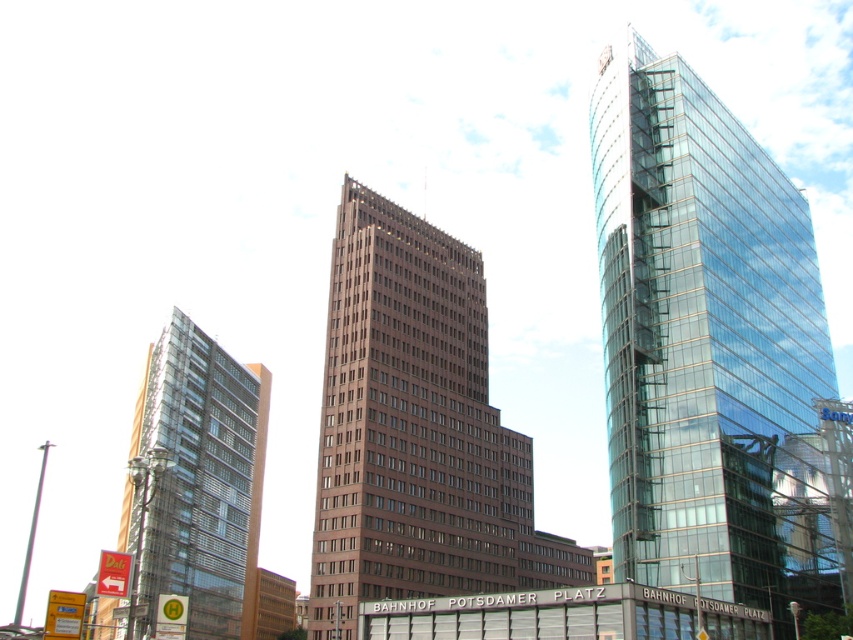
Does point (608, 102) come behind point (407, 280)?

No, (608, 102) is in front of (407, 280).

Which is more to the left, transparent glass tower at right or brown brick building at center?

brown brick building at center

Between point (618, 106) and point (413, 445), which one is positioned behind?

Point (413, 445)

At what (x,y) coordinates should I click in order to perform the action: click on transparent glass tower at right. Please return your answer as a coordinate pair (x, y). The image size is (853, 640). Looking at the image, I should click on (708, 346).

Can you confirm if brown brick building at center is shorter than clear glass building at left?

Yes, brown brick building at center is shorter than clear glass building at left.

Where is `brown brick building at center`? The height and width of the screenshot is (640, 853). brown brick building at center is located at coordinates (416, 429).

Is the position of transparent glass tower at right more distant than that of clear glass building at left?

Yes, transparent glass tower at right is further from the viewer.

Measure the distance between transparent glass tower at right and camera.

transparent glass tower at right is 49.21 meters away from camera.

Does point (822, 332) come in front of point (206, 541)?

Yes, point (822, 332) is closer to viewer.

Where is `transparent glass tower at right`? This screenshot has height=640, width=853. transparent glass tower at right is located at coordinates (708, 346).